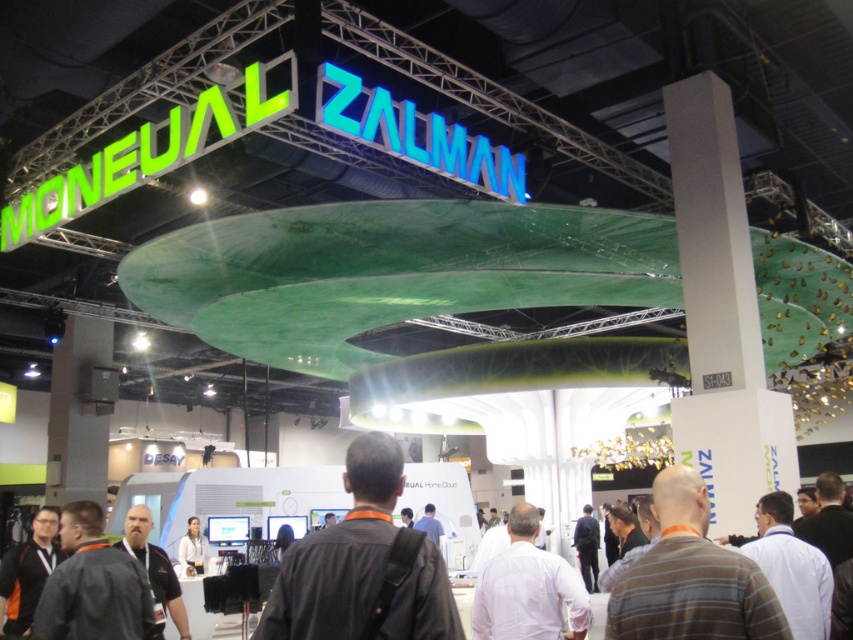
What do you see at coordinates (363, 564) in the screenshot? Image resolution: width=853 pixels, height=640 pixels. I see `black fabric backpack at center` at bounding box center [363, 564].

Is point (399, 529) in front of point (202, 540)?

That is True.

This screenshot has height=640, width=853. I want to click on black fabric backpack at center, so click(363, 564).

Does white matte shirt at center appear over dark gray fabric jacket at lower left?

Yes, white matte shirt at center is above dark gray fabric jacket at lower left.

Does white matte shirt at center have a larger size compared to dark gray fabric jacket at lower left?

Yes, white matte shirt at center is bigger than dark gray fabric jacket at lower left.

Is point (509, 568) closer to viewer compared to point (160, 564)?

Yes, point (509, 568) is in front of point (160, 564).

Locate an element on the screen. white matte shirt at center is located at coordinates (527, 588).

Who is positioned more to the left, brown plaid shirt at lower right or white matte jacket at lower center?

Positioned to the left is white matte jacket at lower center.

Who is more distant from viewer, [732,614] or [200,557]?

Positioned behind is point [200,557].

Who is more distant from viewer, (x=685, y=538) or (x=189, y=525)?

Point (x=189, y=525)

Identify the location of brown plaid shirt at lower right. The height and width of the screenshot is (640, 853). (691, 577).